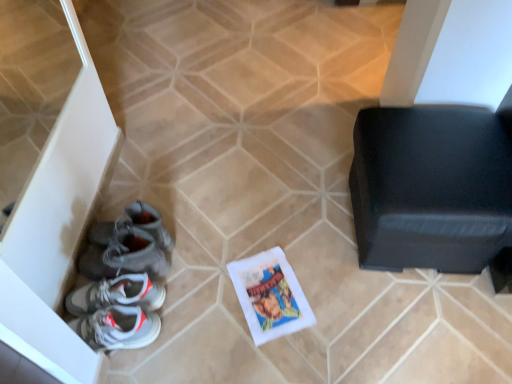
Where is `free point above white paper comic book at center (from a real-world perspective)`? The height and width of the screenshot is (384, 512). free point above white paper comic book at center (from a real-world perspective) is located at coordinates (270, 294).